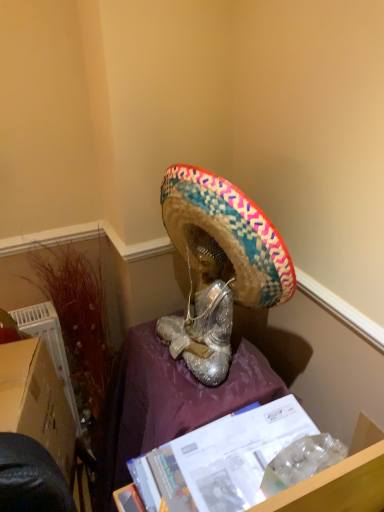
Question: Should I look upward or downward to see white glossy magazine at lower center?

Choices:
 (A) up
 (B) down

Answer: (B)